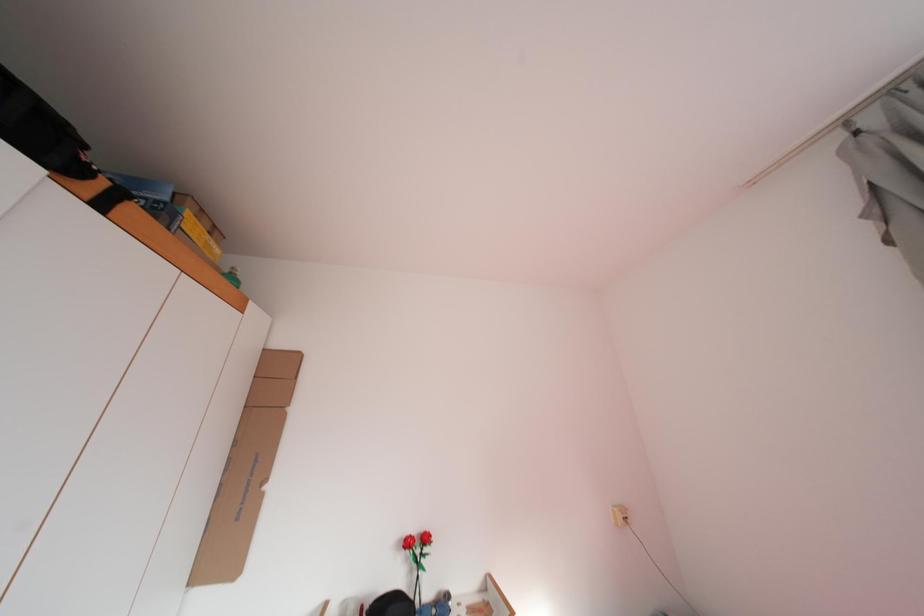
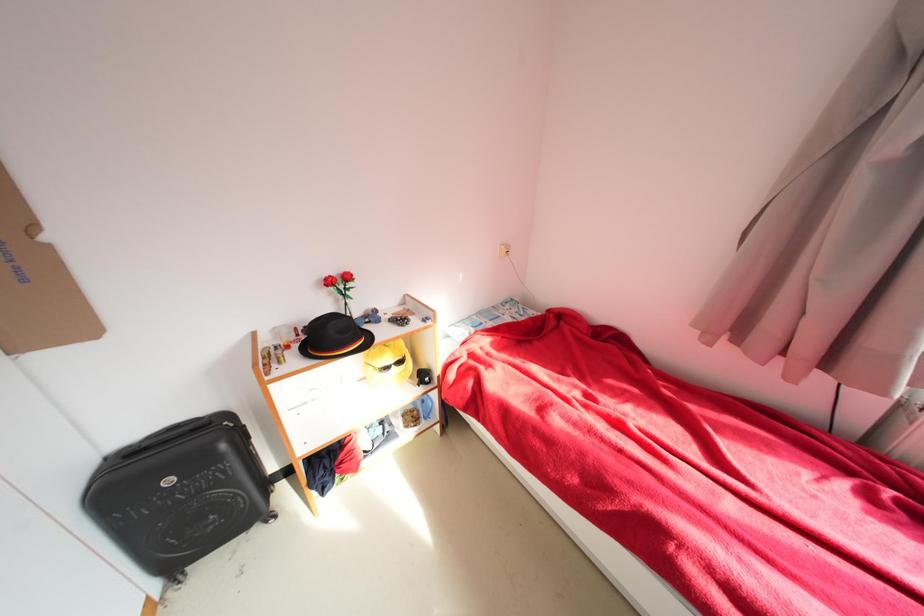
Based on the continuous images, in which direction is the camera rotating?

The camera rotated toward right-down.